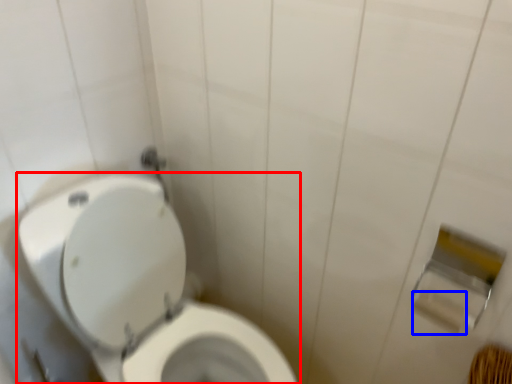
Question: Which of the following is the closest to the observer, toilet (highlighted by a red box) or toilet paper (highlighted by a blue box)?

Choices:
 (A) toilet
 (B) toilet paper

Answer: (A)